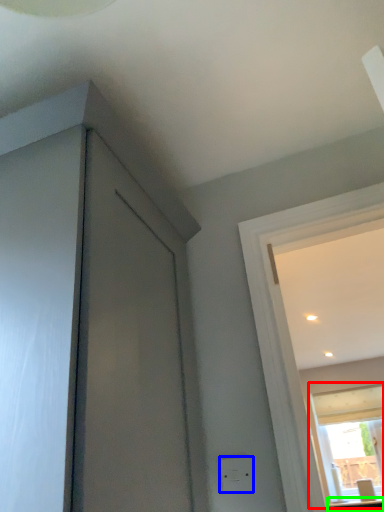
Question: Estimate the real-world distances between objects in this image. Which object is farther from window (highlighted by a red box), electric outlet (highlighted by a blue box) or counter top (highlighted by a green box)?

Choices:
 (A) electric outlet
 (B) counter top

Answer: (A)